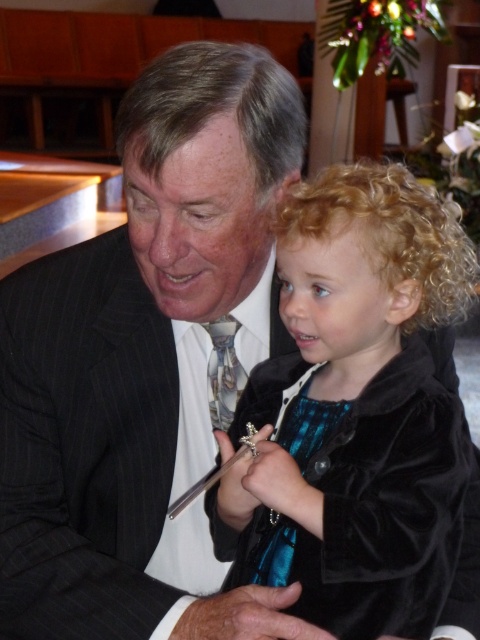
Is point (445, 548) farther from viewer compared to point (233, 344)?

No.

Between point (383, 316) and point (238, 365), which one is positioned in front?

Point (383, 316) is in front.

Which is in front, point (360, 225) or point (217, 371)?

Point (360, 225) is in front.

You are a GUI agent. You are given a task and a screenshot of the screen. Output one action in this format:
    pyautogui.click(x=<x>, y=<y>)
    Task: Click on the velvet black jacket at center
    This screenshot has width=480, height=640.
    Given the screenshot: What is the action you would take?
    coord(356,410)